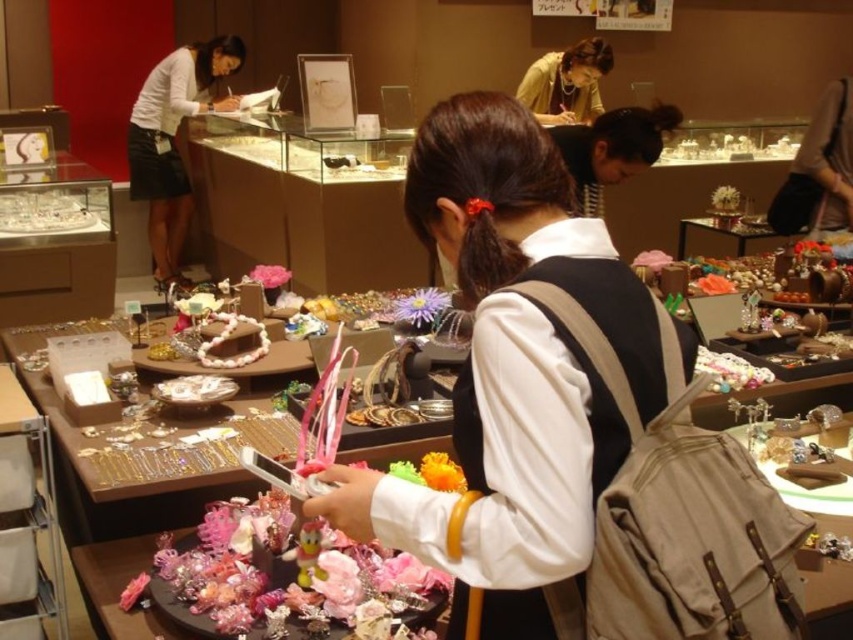
Question: Which of these objects is positioned farthest from the white matte skirt at upper left?

Choices:
 (A) matte yellow blouse at upper center
 (B) white matte backpack at center

Answer: (B)

Question: Among these objects, which one is farthest from the camera?

Choices:
 (A) white matte skirt at upper left
 (B) white matte backpack at center
 (C) matte yellow blouse at upper center

Answer: (A)

Question: Can you confirm if white matte skirt at upper left is positioned to the left of matte yellow blouse at upper center?

Choices:
 (A) yes
 (B) no

Answer: (A)

Question: Which object is the farthest from the matte yellow blouse at upper center?

Choices:
 (A) white matte skirt at upper left
 (B) white matte backpack at center

Answer: (B)

Question: In this image, where is white matte backpack at center located relative to matte yellow blouse at upper center?

Choices:
 (A) right
 (B) left

Answer: (B)

Question: Is white matte skirt at upper left positioned at the back of matte yellow blouse at upper center?

Choices:
 (A) yes
 (B) no

Answer: (A)